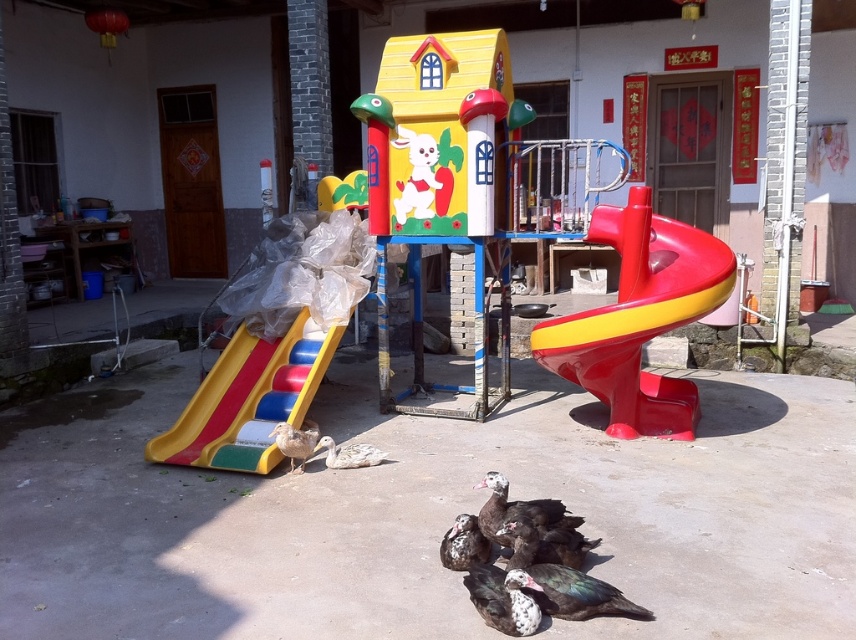
Looking at this image, you are a child playing in the playground and see a dark brown feathers at center and a speckled feathered duckling at center. Which one is located to the right side?

The dark brown feathers at center is located to the right of the speckled feathered duckling at center.

You are a parent trying to ensure your child can safely reach the shiny plastic slide at right from the white matte duck at lower center. Based on the scene, can the child climb from the duck to the slide without needing assistance?

The shiny plastic slide at right is above the white matte duck at lower center, so the child would need assistance to climb up to the slide from the duck since there is a height difference between them.

You are a child trying to decide whether to play on the shiny plastic slide at right or the speckled feathered duckling at center. Which one is wider?

The shiny plastic slide at right is wider than the speckled feathered duckling at center.